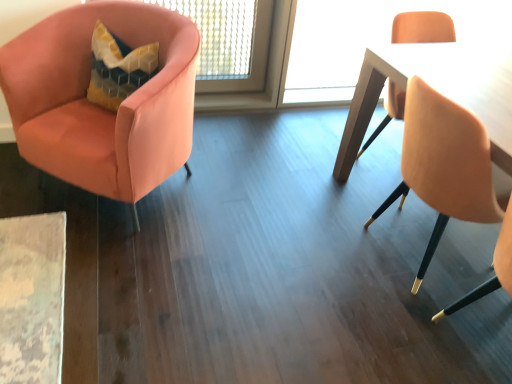
Question: Does wooden table at right have a lesser width compared to matte gold chair at right, the first chair when ordered from right to left?

Choices:
 (A) no
 (B) yes

Answer: (A)

Question: Could you tell me if wooden table at right is facing matte gold chair at right, which appears as the second chair when viewed from the left?

Choices:
 (A) no
 (B) yes

Answer: (B)

Question: From a real-world perspective, is wooden table at right below matte gold chair at right, which appears as the second chair when viewed from the left?

Choices:
 (A) no
 (B) yes

Answer: (B)

Question: Would you say wooden table at right contains matte gold chair at right, the first chair when ordered from right to left?

Choices:
 (A) yes
 (B) no

Answer: (B)

Question: Is wooden table at right bigger than matte gold chair at right, the first chair when ordered from right to left?

Choices:
 (A) no
 (B) yes

Answer: (B)

Question: From a real-world perspective, is satin pink armchair at left, which is the first chair in left-to-right order, physically located above or below matte gold chair at right, which appears as the second chair when viewed from the left?

Choices:
 (A) below
 (B) above

Answer: (A)

Question: From the image's perspective, relative to matte gold chair at right, which appears as the second chair when viewed from the left, is satin pink armchair at left, acting as the 2th chair starting from the right, above or below?

Choices:
 (A) below
 (B) above

Answer: (B)

Question: Choose the correct answer: Is satin pink armchair at left, which is the first chair in left-to-right order, inside matte gold chair at right, which appears as the second chair when viewed from the left, or outside it?

Choices:
 (A) inside
 (B) outside

Answer: (B)

Question: Is point (76, 11) positioned closer to the camera than point (455, 306)?

Choices:
 (A) farther
 (B) closer

Answer: (A)

Question: Would you say matte gold chair at right, the first chair when ordered from right to left, is inside or outside satin pink armchair at left, which is the first chair in left-to-right order?

Choices:
 (A) inside
 (B) outside

Answer: (B)

Question: Looking at the image, does matte gold chair at right, which appears as the second chair when viewed from the left, seem bigger or smaller compared to satin pink armchair at left, acting as the 2th chair starting from the right?

Choices:
 (A) small
 (B) big

Answer: (A)

Question: Is point (402, 135) positioned closer to the camera than point (157, 11)?

Choices:
 (A) closer
 (B) farther

Answer: (B)

Question: From a real-world perspective, is matte gold chair at right, the first chair when ordered from right to left, positioned above or below satin pink armchair at left, which is the first chair in left-to-right order?

Choices:
 (A) above
 (B) below

Answer: (A)

Question: From their relative heights in the image, would you say wooden table at right is taller or shorter than matte gold chair at right, which appears as the second chair when viewed from the left?

Choices:
 (A) short
 (B) tall

Answer: (B)

Question: In the image, is wooden table at right positioned in front of or behind matte gold chair at right, which appears as the second chair when viewed from the left?

Choices:
 (A) front
 (B) behind

Answer: (B)